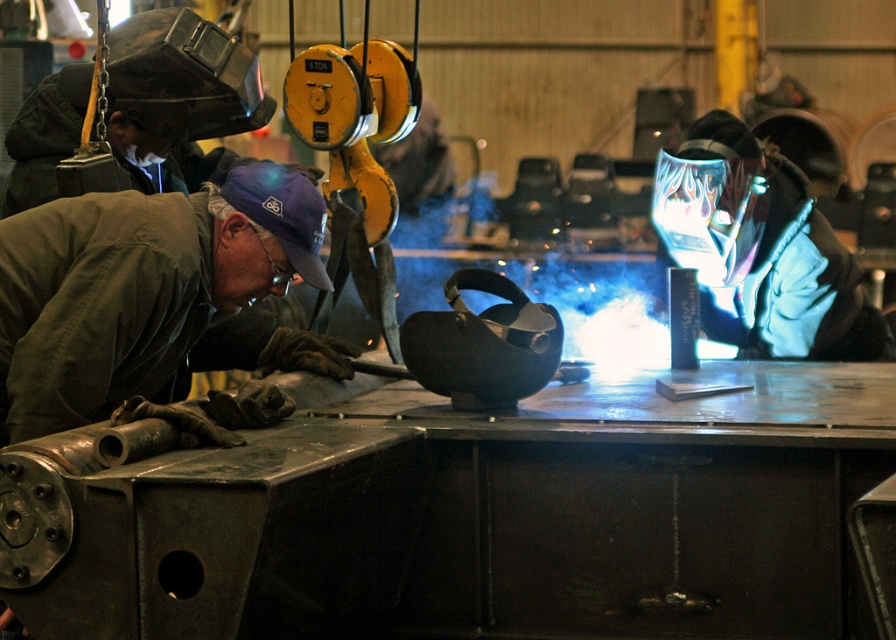
You are an inspector in the workshop and need to check the safety equipment of the workers. According to the image, where is the green matte jacket at left in relation to the shiny chrome helmet at center?

The green matte jacket at left is positioned below the shiny chrome helmet at center.

You are a new worker in the workshop and need to locate two specific points marked on a metal plate. The points are labeled as point 1 at coordinates point (11, 428) and point 2 at coordinates point (701, 241). Which point is closer to you when you are facing the metal plate?

Point (11, 428) is closer to the camera than point (701, 241), so when facing the metal plate, point (11, 428) will be closer to you.